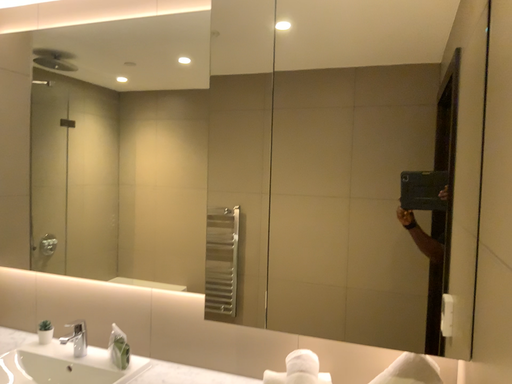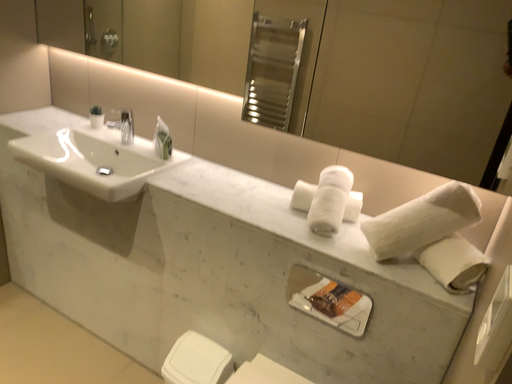
Question: Which way did the camera rotate in the video?

Choices:
 (A) rotated right
 (B) rotated left

Answer: (B)